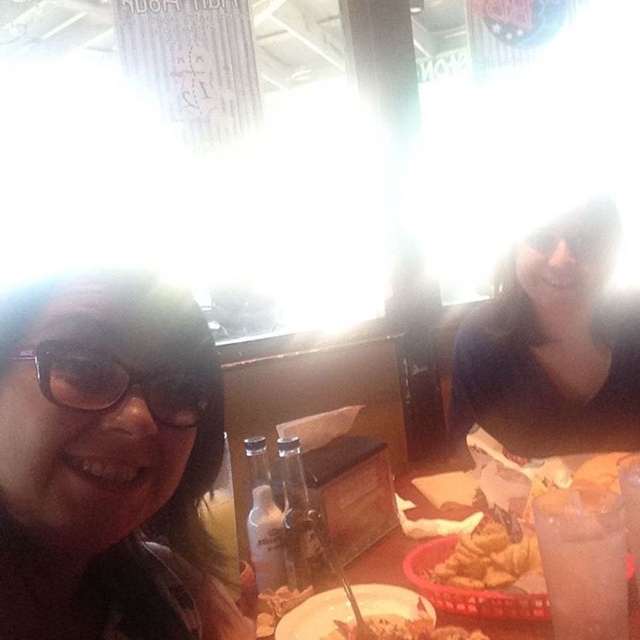
Looking at this image, who is more distant from viewer, (x=99, y=412) or (x=426, y=621)?

Point (x=426, y=621)

Find the location of a particular element. The height and width of the screenshot is (640, 640). black plastic goggles at left is located at coordinates (116, 381).

Between point (104, 356) and point (374, 627), which one is positioned behind?

Point (374, 627)

The width and height of the screenshot is (640, 640). What are the coordinates of `black plastic goggles at left` in the screenshot? It's located at (116, 381).

Who is higher up, matte plastic basket at center or golden crispy bread at center?

golden crispy bread at center is higher up.

Between point (589, 520) and point (500, 570), which one is positioned in front?

Point (589, 520) is in front.

The height and width of the screenshot is (640, 640). What are the coordinates of `matte plastic basket at center` in the screenshot? It's located at (584, 556).

Between black plastic goggles at left and transparent plastic goggles at upper center, which one is positioned lower?

black plastic goggles at left is below.

Consider the image. Does black plastic goggles at left lie in front of transparent plastic goggles at upper center?

Yes, it is in front of transparent plastic goggles at upper center.

This screenshot has height=640, width=640. What do you see at coordinates (116, 381) in the screenshot?
I see `black plastic goggles at left` at bounding box center [116, 381].

I want to click on black plastic goggles at left, so click(x=116, y=381).